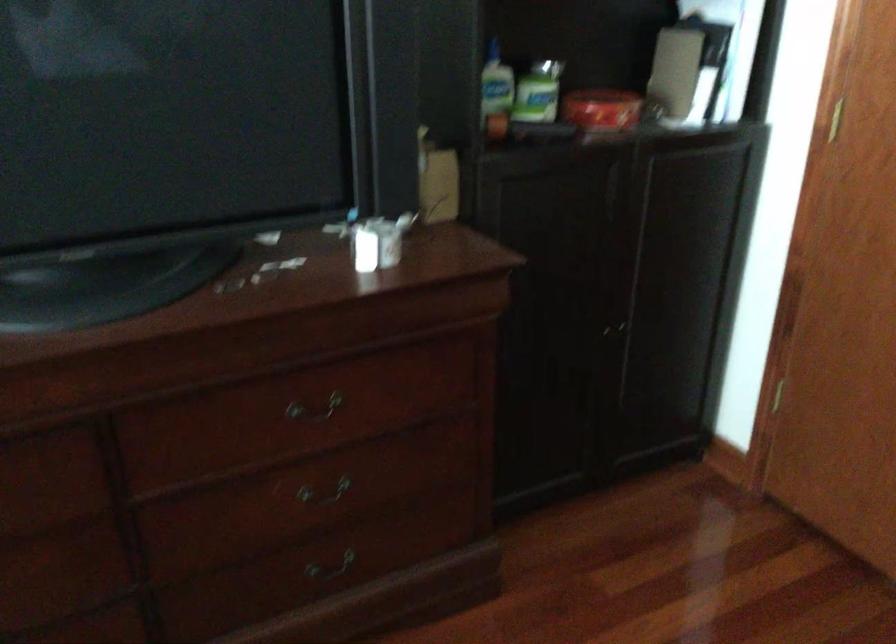
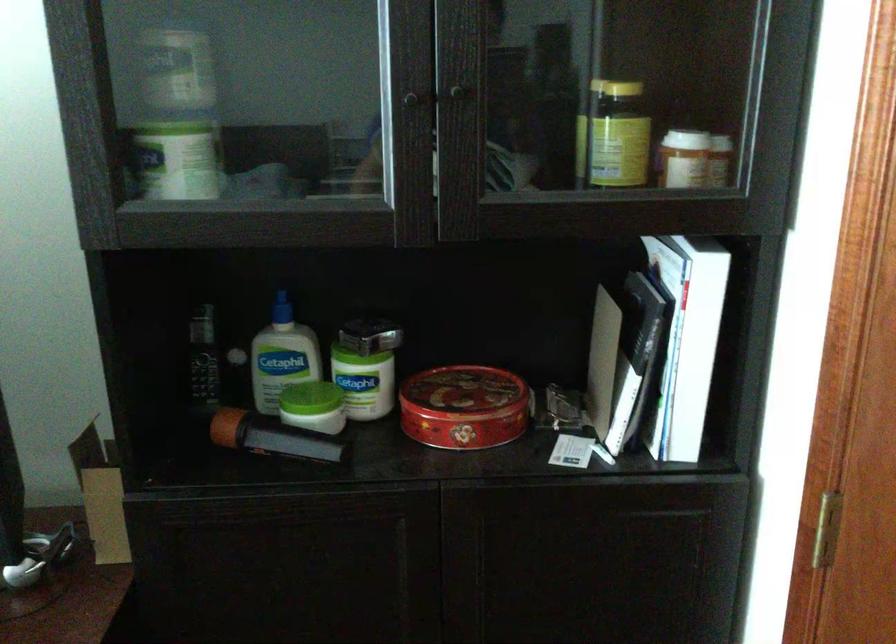
Find the pixel in the second image that matches (754,67) in the first image.

(728, 373)